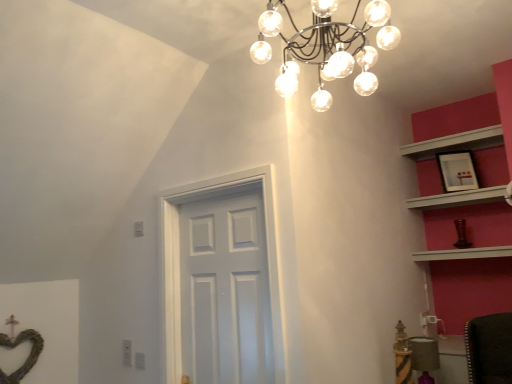
Describe the element at coordinates (455, 143) in the screenshot. Image resolution: width=512 pixels, height=384 pixels. I see `white wooden shelf at upper right, the 2th shelf from the bottom` at that location.

In order to face white glossy door at center, should I rotate leftwards or rightwards?

You should look left and rotate roughly 5.510 degrees.

What is the approximate height of white wooden shelf at upper right, the second shelf positioned from the top?

3.85 inches.

Measure the distance between matte black picture frame at upper right and camera.

A distance of 2.77 meters exists between matte black picture frame at upper right and camera.

At what (x,y) coordinates should I click in order to perform the action: click on white wooden shelf at upper right, the 2th shelf from the bottom. Please return your answer as a coordinate pair (x, y). This screenshot has width=512, height=384. Looking at the image, I should click on (455, 143).

Considering the relative sizes of metallic chandelier at upper center and white glossy door at center in the image provided, is metallic chandelier at upper center wider than white glossy door at center?

Indeed, metallic chandelier at upper center has a greater width compared to white glossy door at center.

Considering the sizes of metallic chandelier at upper center and white glossy door at center in the image, is metallic chandelier at upper center taller or shorter than white glossy door at center?

Clearly, metallic chandelier at upper center is shorter compared to white glossy door at center.

In the image, is metallic chandelier at upper center on the left side or the right side of white glossy door at center?

Clearly, metallic chandelier at upper center is on the right of white glossy door at center in the image.

From the picture: Is there a large distance between metallic chandelier at upper center and white glossy door at center?

No, metallic chandelier at upper center is not far from white glossy door at center.

Can you confirm if white glossy door at center is taller than white wooden shelf at upper right, positioned as the 1th shelf in bottom-to-top order?

Yes.

Between white glossy door at center and white wooden shelf at upper right, the second shelf positioned from the top, which one is positioned in front?

Positioned in front is white glossy door at center.

How far apart are white glossy door at center and white wooden shelf at upper right, positioned as the 1th shelf in bottom-to-top order?

1.56 meters.

Is point (277, 330) farther from viewer compared to point (411, 204)?

No, it is not.

Does white glossy door at center have a lesser height compared to white wooden shelf at upper right, the first shelf when ordered from top to bottom?

No, white glossy door at center is not shorter than white wooden shelf at upper right, the first shelf when ordered from top to bottom.

Consider the image. Does white glossy door at center appear on the left side of white wooden shelf at upper right, the first shelf when ordered from top to bottom?

Yes, white glossy door at center is to the left of white wooden shelf at upper right, the first shelf when ordered from top to bottom.

Considering the relative sizes of white glossy door at center and white wooden shelf at upper right, the 2th shelf from the bottom, in the image provided, is white glossy door at center smaller than white wooden shelf at upper right, the 2th shelf from the bottom,?

Incorrect, white glossy door at center is not smaller in size than white wooden shelf at upper right, the 2th shelf from the bottom.

From the image's perspective, is white glossy door at center above or below white wooden shelf at upper right, the first shelf when ordered from top to bottom?

white glossy door at center is below white wooden shelf at upper right, the first shelf when ordered from top to bottom.

Find the location of a particular element. picture frame directly beneath the metallic chandelier at upper center (from a real-world perspective) is located at coordinates (457, 171).

Considering the relative sizes of metallic chandelier at upper center and matte black picture frame at upper right in the image provided, is metallic chandelier at upper center smaller than matte black picture frame at upper right?

Actually, metallic chandelier at upper center might be larger than matte black picture frame at upper right.

From a real-world perspective, which is physically above, metallic chandelier at upper center or matte black picture frame at upper right?

metallic chandelier at upper center is physically above.

Is white glossy door at center oriented away from matte black picture frame at upper right?

white glossy door at center is not turned away from matte black picture frame at upper right.

Where is `door that appears below the matte black picture frame at upper right (from a real-world perspective)`? The height and width of the screenshot is (384, 512). door that appears below the matte black picture frame at upper right (from a real-world perspective) is located at coordinates (179, 263).

Are white glossy door at center and matte black picture frame at upper right located far from each other?

white glossy door at center is positioned a significant distance from matte black picture frame at upper right.

From their relative heights in the image, would you say white glossy door at center is taller or shorter than matte black picture frame at upper right?

white glossy door at center is taller than matte black picture frame at upper right.

From the image's perspective, is matte black picture frame at upper right under white wooden shelf at upper right, positioned as the 1th shelf in bottom-to-top order?

Incorrect, from the image's perspective, matte black picture frame at upper right is higher than white wooden shelf at upper right, positioned as the 1th shelf in bottom-to-top order.

Based on the photo, is matte black picture frame at upper right turned away from white wooden shelf at upper right, positioned as the 1th shelf in bottom-to-top order?

matte black picture frame at upper right does not have its back to white wooden shelf at upper right, positioned as the 1th shelf in bottom-to-top order.

Choose the correct answer: Is matte black picture frame at upper right inside white wooden shelf at upper right, the second shelf positioned from the top, or outside it?

matte black picture frame at upper right is spatially situated outside white wooden shelf at upper right, the second shelf positioned from the top.

Can you confirm if matte black picture frame at upper right is taller than white wooden shelf at upper right, the second shelf positioned from the top?

Correct, matte black picture frame at upper right is much taller as white wooden shelf at upper right, the second shelf positioned from the top.

Are white wooden shelf at upper right, the second shelf positioned from the top, and matte black picture frame at upper right making contact?

No, white wooden shelf at upper right, the second shelf positioned from the top, is not with matte black picture frame at upper right.

Is point (480, 202) closer to viewer compared to point (467, 181)?

No, it is not.

How far apart are white wooden shelf at upper right, the second shelf positioned from the top, and matte black picture frame at upper right?

white wooden shelf at upper right, the second shelf positioned from the top, and matte black picture frame at upper right are 6.57 inches apart from each other.

Considering the relative sizes of white wooden shelf at upper right, positioned as the 1th shelf in bottom-to-top order, and matte black picture frame at upper right in the image provided, is white wooden shelf at upper right, positioned as the 1th shelf in bottom-to-top order, shorter than matte black picture frame at upper right?

Yes.

The image size is (512, 384). I want to click on door below the metallic chandelier at upper center (from a real-world perspective), so click(179, 263).

Identify the location of door that is in front of the white wooden shelf at upper right, the second shelf positioned from the top. The width and height of the screenshot is (512, 384). (179, 263).

Which object lies further to the anchor point white wooden shelf at upper right, the second shelf positioned from the top, white glossy door at center or white wooden shelf at upper right, the first shelf when ordered from top to bottom?

Among the two, white glossy door at center is located further to white wooden shelf at upper right, the second shelf positioned from the top.

Estimate the real-world distances between objects in this image. Which object is further from velvet purple chair at lower right, white wooden shelf at upper right, the second shelf positioned from the top, or white wooden shelf at upper right, the first shelf when ordered from top to bottom?

Based on the image, white wooden shelf at upper right, the first shelf when ordered from top to bottom, appears to be further to velvet purple chair at lower right.

When comparing their distances from white wooden shelf at upper right, the 2th shelf from the bottom, does velvet purple chair at lower right or matte black picture frame at upper right seem closer?

matte black picture frame at upper right lies closer to white wooden shelf at upper right, the 2th shelf from the bottom, than the other object.

Considering their positions, is matte black picture frame at upper right positioned further to velvet purple chair at lower right than metallic chandelier at upper center?

Among the two, metallic chandelier at upper center is located further to velvet purple chair at lower right.

Estimate the real-world distances between objects in this image. Which object is further from velvet purple chair at lower right, matte black picture frame at upper right or white glossy door at center?

The object further to velvet purple chair at lower right is white glossy door at center.

From the picture: Estimate the real-world distances between objects in this image. Which object is further from matte black picture frame at upper right, white glossy door at center or white wooden shelf at upper right, positioned as the 1th shelf in bottom-to-top order?

white glossy door at center is further to matte black picture frame at upper right.

Which object lies further to the anchor point metallic chandelier at upper center, velvet purple chair at lower right or matte black picture frame at upper right?

The object further to metallic chandelier at upper center is velvet purple chair at lower right.

From the image, which object appears to be farther from matte black picture frame at upper right, metallic chandelier at upper center or white glossy door at center?

white glossy door at center.

Identify the location of shelf located between white glossy door at center and matte black picture frame at upper right in the left-right direction. (455, 143).

Find the location of a particular element. The image size is (512, 384). door between metallic chandelier at upper center and velvet purple chair at lower right in the vertical direction is located at coordinates (179, 263).

This screenshot has width=512, height=384. Find the location of `picture frame between white glossy door at center and white wooden shelf at upper right, positioned as the 1th shelf in bottom-to-top order, in the horizontal direction`. picture frame between white glossy door at center and white wooden shelf at upper right, positioned as the 1th shelf in bottom-to-top order, in the horizontal direction is located at coordinates (457, 171).

At what (x,y) coordinates should I click in order to perform the action: click on shelf positioned between metallic chandelier at upper center and white wooden shelf at upper right, the first shelf when ordered from top to bottom, from near to far. Please return your answer as a coordinate pair (x, y). Image resolution: width=512 pixels, height=384 pixels. Looking at the image, I should click on (459, 198).